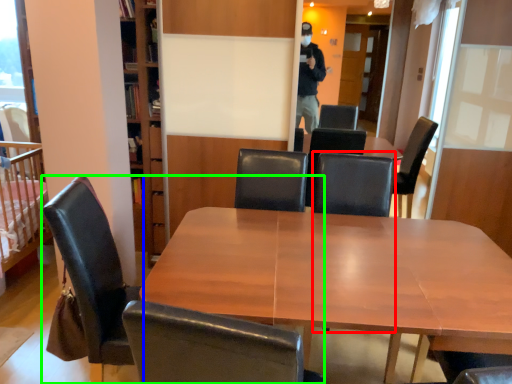
Question: Based on their relative distances, which object is nearer to armchair (highlighted by a red box)? Choose from chair (highlighted by a blue box) and chair (highlighted by a green box).

Choices:
 (A) chair
 (B) chair

Answer: (A)